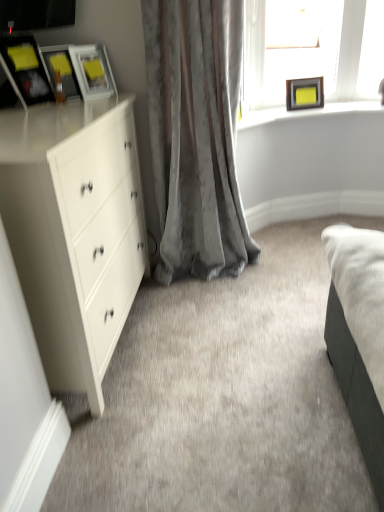
Question: Is matte black picture frame at upper left, which ranks as the first picture frame in left-to-right order, taller or shorter than matte black picture frame at upper left, which is the third picture frame in back-to-front order?

Choices:
 (A) tall
 (B) short

Answer: (A)

Question: Considering their positions, is matte black picture frame at upper left, which ranks as the first picture frame in left-to-right order, located in front of or behind matte black picture frame at upper left, which is the 2th picture frame in front-to-back order?

Choices:
 (A) front
 (B) behind

Answer: (A)

Question: Estimate the real-world distances between objects in this image. Which object is closer to the white matte chest of drawers at left?

Choices:
 (A) matte black picture frame at upper right, which ranks as the fourth picture frame in left-to-right order
 (B) velvet gray curtain at center
 (C) matte black picture frame at upper left, which is the third picture frame in back-to-front order
 (D) matte white picture frame at upper left, placed as the 3th picture frame when sorted from front to back
 (E) matte wooden frame at upper right

Answer: (B)

Question: Which of these objects is positioned closest to the matte wooden frame at upper right?

Choices:
 (A) matte black picture frame at upper left, acting as the second picture frame starting from the left
 (B) white matte chest of drawers at left
 (C) clear glass frame at upper right
 (D) velvet gray curtain at center
 (E) matte black picture frame at upper left, placed as the first picture frame when sorted from front to back

Answer: (C)